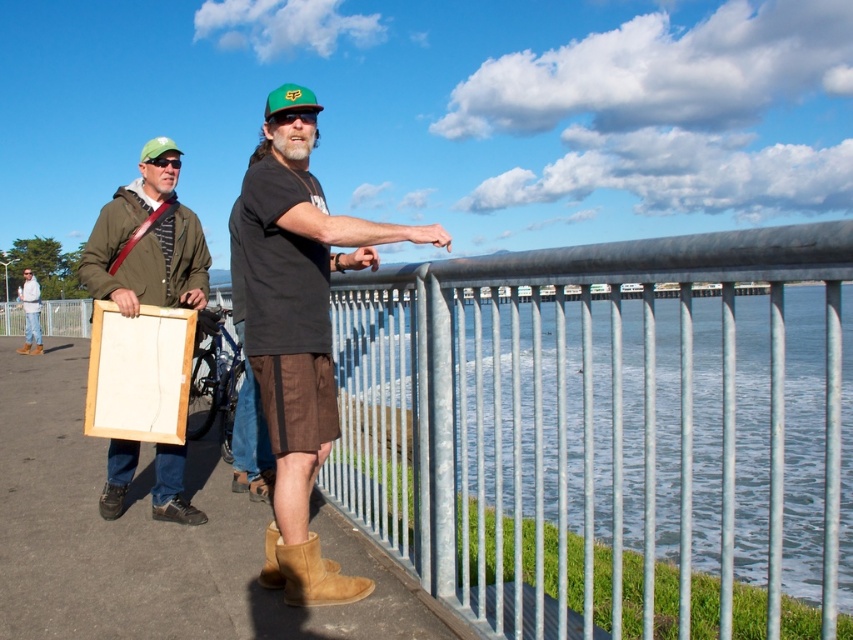
You are a photographer trying to capture a photo of the person on the right without including the denim jacket at left in the frame. Based on their positions, is this possible?

The denim jacket at left is located at point [30,314], so if the photographer positions the camera to exclude this coordinate, it might be possible to capture the person on the right without including the jacket.

You are a photographer trying to capture a photo of both the brown suede boots at center and the denim jacket at left. Based on their positions, which object should you focus on first to ensure both are in sharp focus?

You should focus on the denim jacket at left first because it is farther away from the viewer compared to the brown suede boots at center, allowing the boots to fall within the depth of field when focused on the farther object.

You are a photographer trying to capture a photo of both the brown suede boots at center and the tan suede boot at lower center. Based on their positions, which boot should you focus on first to ensure both are in frame?

The brown suede boots at center is to the left of tan suede boot at lower center, so you should focus on the tan suede boot at lower center first to ensure both are in frame.